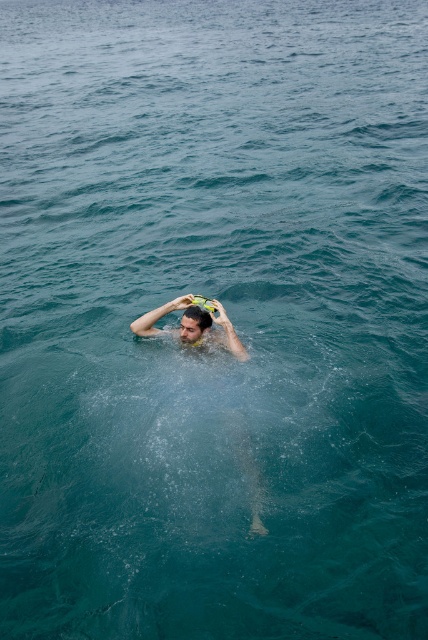
Question: Which point is farther from the camera taking this photo?

Choices:
 (A) (196, 307)
 (B) (166, 312)
 (C) (202, 317)

Answer: (B)

Question: Considering the real-world distances, which object is farthest from the smooth skin man at center?

Choices:
 (A) matte black hair at upper center
 (B) yellow-green rubber snorkel at center

Answer: (A)

Question: Which object appears closest to the camera in this image?

Choices:
 (A) smooth skin man at center
 (B) matte black hair at upper center

Answer: (A)

Question: Is yellow-green rubber snorkel at center below matte black hair at upper center?

Choices:
 (A) no
 (B) yes

Answer: (A)

Question: Is smooth skin man at center in front of matte black hair at upper center?

Choices:
 (A) no
 (B) yes

Answer: (B)

Question: Can you confirm if yellow-green rubber snorkel at center is bigger than matte black hair at upper center?

Choices:
 (A) no
 (B) yes

Answer: (B)